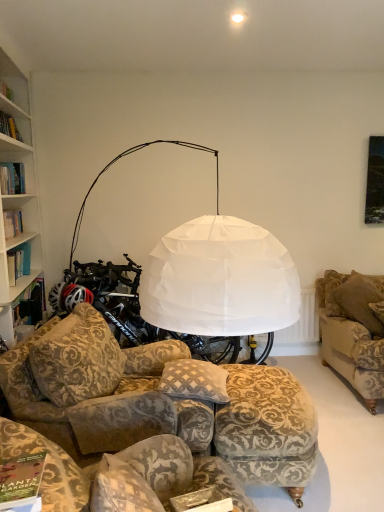
You are a GUI agent. You are given a task and a screenshot of the screen. Output one action in this format:
    pyautogui.click(x=<x>, y=<y>)
    Task: Click on the free spot above velvet floral ottoman at lower center (from a real-world perspective)
    
    Given the screenshot: What is the action you would take?
    pyautogui.click(x=261, y=387)